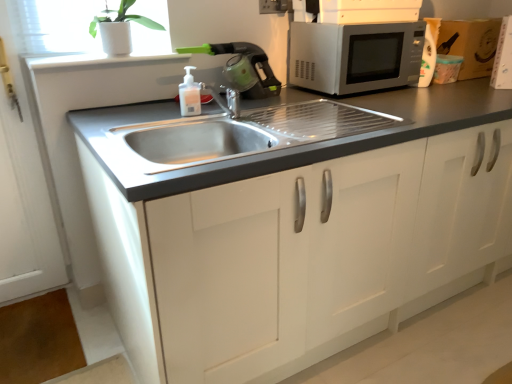
Question: Is point (184, 77) closer or farther from the camera than point (301, 317)?

Choices:
 (A) closer
 (B) farther

Answer: (B)

Question: From a real-world perspective, relative to white matte cabinet at center, is translucent plastic soap dispenser at center vertically above or below?

Choices:
 (A) above
 (B) below

Answer: (A)

Question: Which object is the closest to the green plastic coffee machine at upper center?

Choices:
 (A) satin silver microwave at upper right
 (B) white glossy window sill at upper left
 (C) white ceramic pot at upper left
 (D) black plastic electric outlet at upper center
 (E) white matte cabinet at center

Answer: (B)

Question: Which object is positioned closest to the translucent plastic soap dispenser at center?

Choices:
 (A) white ceramic pot at upper left
 (B) white matte cabinet at center
 (C) green plastic coffee machine at upper center
 (D) satin silver microwave at upper right
 (E) black plastic electric outlet at upper center

Answer: (C)